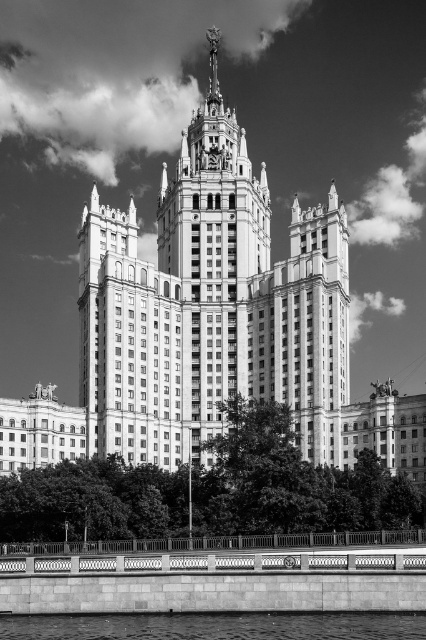
You are a drone operator tasked with capturing aerial footage of the smooth concrete tower at center and the smooth concrete river at lower center. Your drone has a maximum flight range of 30 meters. Can you fly your drone from the tower to the river without exceeding its range?

The distance between the smooth concrete tower at center and the smooth concrete river at lower center is 33.16 meters, which exceeds the drone maximum flight range of 30 meters. Therefore, the drone cannot fly from the tower to the river without exceeding its range.

You are a drone operator tasked with capturing aerial footage of the white stone tower at center and the smooth concrete river at lower center. Your drone has a maximum flight range of 40 meters. Can you fly the drone from the river to the tower without exceeding its range?

The distance between the white stone tower at center and the smooth concrete river at lower center is 42.75 meters, which exceeds the drone operator maximum flight range of 40 meters. Therefore, the drone cannot reach the tower from the river without exceeding its range.